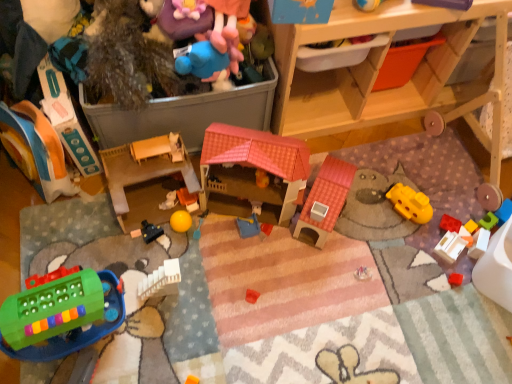
This screenshot has height=384, width=512. Identify the location of vacant space that's between translucent plastic cube at center, which is counted as the 13th toy, starting from the left, and blue plastic toy at center, which is the fifth toy from right to left. click(x=364, y=232).